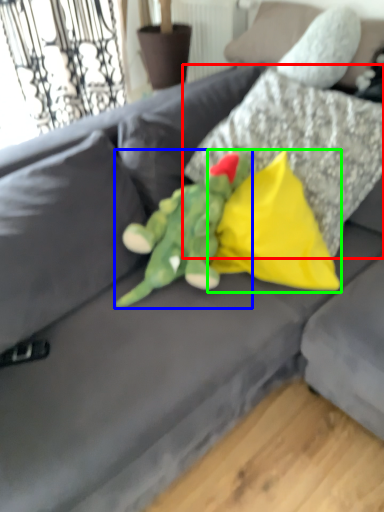
Question: Based on their relative distances, which object is nearer to pillow (highlighted by a red box)? Choose from toy (highlighted by a blue box) and pillow (highlighted by a green box).

Choices:
 (A) toy
 (B) pillow

Answer: (B)